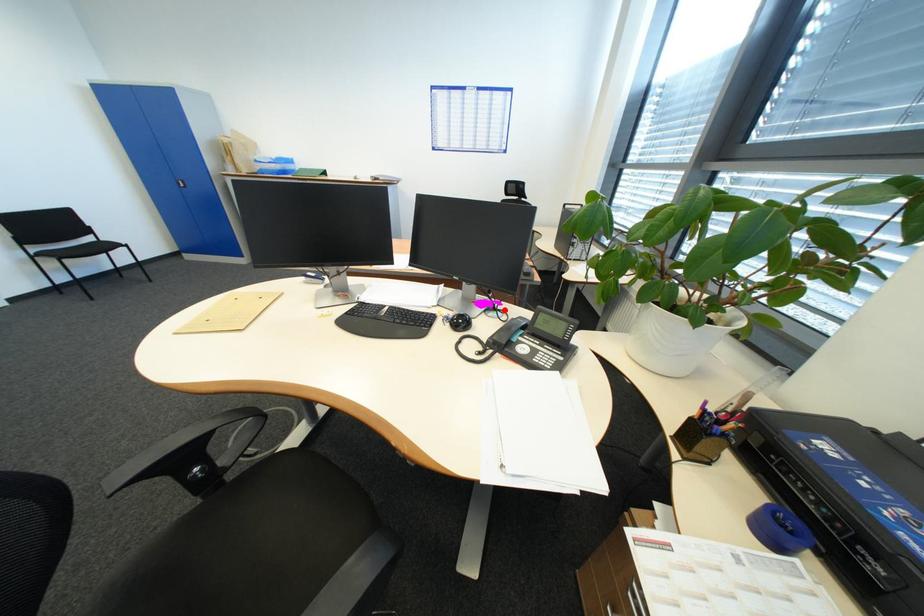
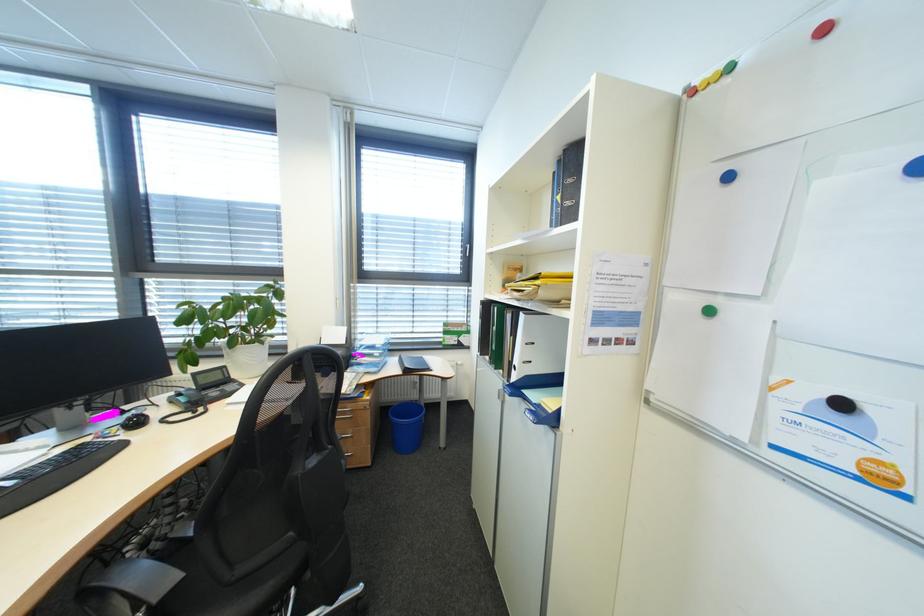
In the second image, find the point that corresponds to the highlighted location in the first image.

(134, 413)